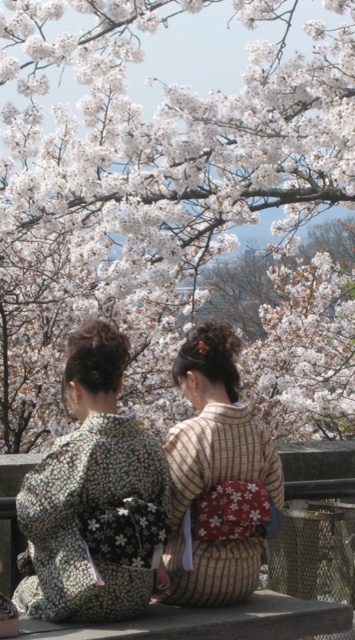
You are a photographer trying to capture the floral kimono at center and the white blossoms at center in a single shot. Which object should you focus on first to ensure both are in frame?

You should focus on the white blossoms at center first since it is closer to the viewer than the floral kimono at center, allowing you to adjust the framing to include both objects.

You are a photographer aiming to capture the beauty of the white blossoms at center and the floral kimono at center. Based on their positions, which one is higher in the frame?

The white blossoms at center are positioned above the floral kimono at center, making them higher in the frame.